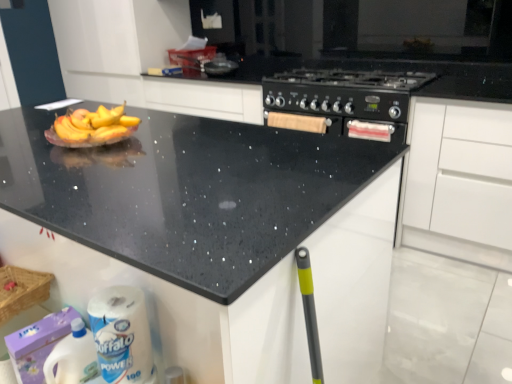
Image resolution: width=512 pixels, height=384 pixels. Describe the element at coordinates (461, 172) in the screenshot. I see `white matte cabinet at lower right` at that location.

Describe the element at coordinates (122, 335) in the screenshot. I see `white paper towel at lower left` at that location.

In order to face white plastic bottle at lower left, should I rotate leftwards or rightwards?

Rotate left and turn 23.714 degrees.

Where is `white matte cabinet at lower right`? This screenshot has width=512, height=384. white matte cabinet at lower right is located at coordinates (461, 172).

Who is smaller, white paper towel at lower left or white matte cabinet at lower right?

Smaller between the two is white paper towel at lower left.

Is the depth of white paper towel at lower left greater than that of white matte cabinet at lower right?

No, it is in front of white matte cabinet at lower right.

Is white paper towel at lower left aimed at white matte cabinet at lower right?

No, white paper towel at lower left does not turn towards white matte cabinet at lower right.

Looking at the image, does black speckled granite at upper center seem bigger or smaller compared to white plastic bottle at lower left?

Clearly, black speckled granite at upper center is larger in size than white plastic bottle at lower left.

Is black speckled granite at upper center placed right next to white plastic bottle at lower left?

They are not placed beside each other.

Is black speckled granite at upper center wider or thinner than white plastic bottle at lower left?

Considering their sizes, black speckled granite at upper center looks broader than white plastic bottle at lower left.

Between point (105, 195) and point (72, 333), which one is positioned behind?

The point (72, 333) is behind.

From a real-world perspective, between white plastic bottle at lower left and black matte stove at center, who is vertically lower?

white plastic bottle at lower left is physically lower.

Can you confirm if white plastic bottle at lower left is wider than black matte stove at center?

In fact, white plastic bottle at lower left might be narrower than black matte stove at center.

What are the coordinates of `cleaning product that appears below the black matte stove at center (from the image's perspective)` in the screenshot? It's located at (73, 357).

Is white plastic bottle at lower left taller or shorter than black matte stove at center?

white plastic bottle at lower left is taller than black matte stove at center.

Considering the sizes of objects white plastic bottle at lower left and white paper towel at lower left in the image provided, who is wider, white plastic bottle at lower left or white paper towel at lower left?

white plastic bottle at lower left is wider.

From the image's perspective, relative to white paper towel at lower left, is white plastic bottle at lower left above or below?

Based on their image positions, white plastic bottle at lower left is located beneath white paper towel at lower left.

Is white plastic bottle at lower left facing away from white paper towel at lower left?

white plastic bottle at lower left does not have its back to white paper towel at lower left.

From a real-world perspective, is white plastic bottle at lower left positioned over white paper towel at lower left based on gravity?

No, from a real-world perspective, white plastic bottle at lower left is not above white paper towel at lower left.

Considering the relative positions of white matte cabinet at lower right and white paper towel at lower left in the image provided, is white matte cabinet at lower right to the left of white paper towel at lower left from the viewer's perspective?

No.

How different are the orientations of white matte cabinet at lower right and white paper towel at lower left in degrees?

white matte cabinet at lower right and white paper towel at lower left are facing 0.561 degrees away from each other.

Considering the points (501, 145) and (106, 307), which point is behind, point (501, 145) or point (106, 307)?

The point (501, 145) is behind.

From the image's perspective, who appears lower, white matte cabinet at lower right or white paper towel at lower left?

white paper towel at lower left appears lower in the image.

Would you say black matte stove at center is part of white matte cabinet at lower right's contents?

No, black matte stove at center is not a part of white matte cabinet at lower right.

Which is further, [505,219] or [346,122]?

Positioned behind is point [346,122].

Is white matte cabinet at lower right far away from black matte stove at center?

white matte cabinet at lower right is actually quite close to black matte stove at center.

Which of these two, white matte cabinet at lower right or black matte stove at center, is smaller?

Smaller between the two is black matte stove at center.

Does black matte stove at center have a smaller size compared to white plastic bottle at lower left?

Incorrect, black matte stove at center is not smaller in size than white plastic bottle at lower left.

From a real-world perspective, is black matte stove at center on top of white plastic bottle at lower left?

Yes, from a real-world perspective, black matte stove at center is above white plastic bottle at lower left.

Is black matte stove at center placed right next to white plastic bottle at lower left?

black matte stove at center is not next to white plastic bottle at lower left, and they're not touching.

At what (x,y) coordinates should I click in order to perform the action: click on cabinetry on the right of white paper towel at lower left. Please return your answer as a coordinate pair (x, y). The image size is (512, 384). Looking at the image, I should click on (461, 172).

Image resolution: width=512 pixels, height=384 pixels. In the image, there is a black speckled granite at upper center. Find the location of `cleaning product below it (from a real-world perspective)`. cleaning product below it (from a real-world perspective) is located at coordinates (73, 357).

Estimate the real-world distances between objects in this image. Which object is closer to white matte cabinet at lower right, black speckled granite at upper center or white plastic bottle at lower left?

The object closer to white matte cabinet at lower right is black speckled granite at upper center.

Looking at the image, which one is located further to black speckled granite at upper center, white paper towel at lower left or white plastic bottle at lower left?

Among the two, white plastic bottle at lower left is located further to black speckled granite at upper center.

From the image, which object appears to be farther from white paper towel at lower left, white plastic bottle at lower left or black matte stove at center?

black matte stove at center is positioned further to the anchor white paper towel at lower left.

Estimate the real-world distances between objects in this image. Which object is further from white matte cabinet at lower right, black speckled granite at upper center or black matte stove at center?

The object further to white matte cabinet at lower right is black speckled granite at upper center.

Based on their spatial positions, is white paper towel at lower left or white plastic bottle at lower left further from black matte stove at center?

white plastic bottle at lower left is further to black matte stove at center.

Which object lies nearer to the anchor point black speckled granite at upper center, white matte cabinet at lower right or white plastic bottle at lower left?

white plastic bottle at lower left lies closer to black speckled granite at upper center than the other object.

Based on the photo, looking at the image, which one is located closer to black speckled granite at upper center, white paper towel at lower left or white matte cabinet at lower right?

white paper towel at lower left is positioned closer to the anchor black speckled granite at upper center.

When comparing their distances from black speckled granite at upper center, does white plastic bottle at lower left or white paper towel at lower left seem further?

white plastic bottle at lower left is further to black speckled granite at upper center.

Locate an element on the screen. The height and width of the screenshot is (384, 512). toilet paper between black matte stove at center and white plastic bottle at lower left vertically is located at coordinates (122, 335).

In order to click on appliance between white paper towel at lower left and white matte cabinet at lower right in this screenshot , I will do `click(341, 100)`.

Where is `appliance between white plastic bottle at lower left and white matte cabinet at lower right in the horizontal direction`? Image resolution: width=512 pixels, height=384 pixels. appliance between white plastic bottle at lower left and white matte cabinet at lower right in the horizontal direction is located at coordinates (341, 100).

At what (x,y) coordinates should I click in order to perform the action: click on appliance between black speckled granite at upper center and white matte cabinet at lower right from left to right. Please return your answer as a coordinate pair (x, y). Image resolution: width=512 pixels, height=384 pixels. Looking at the image, I should click on (341, 100).